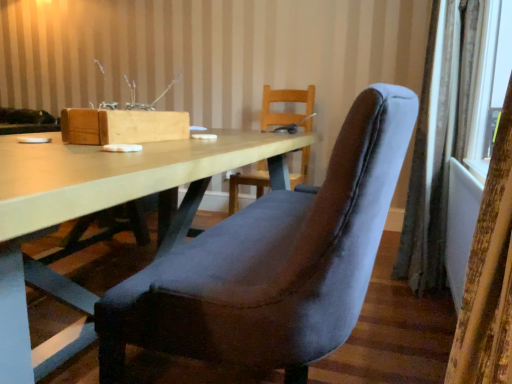
Question: Is velvet curtain at right, arranged as the 2th curtain when viewed from the right, shorter than velvet blue chair at center?

Choices:
 (A) yes
 (B) no

Answer: (A)

Question: Can you confirm if velvet curtain at right, which is the second curtain in back-to-front order, is bigger than velvet blue chair at center?

Choices:
 (A) no
 (B) yes

Answer: (A)

Question: Does velvet curtain at right, acting as the first curtain starting from the left, appear on the right side of velvet blue chair at center?

Choices:
 (A) no
 (B) yes

Answer: (B)

Question: Considering the relative positions of velvet curtain at right, which is the second curtain in back-to-front order, and velvet blue chair at center in the image provided, is velvet curtain at right, which is the second curtain in back-to-front order, behind velvet blue chair at center?

Choices:
 (A) yes
 (B) no

Answer: (B)

Question: From the image's perspective, is velvet curtain at right, arranged as the 2th curtain when viewed from the right, located beneath velvet blue chair at center?

Choices:
 (A) yes
 (B) no

Answer: (B)

Question: Is velvet curtain at right, acting as the first curtain starting from the front, beside velvet blue chair at center?

Choices:
 (A) yes
 (B) no

Answer: (B)

Question: From the image's perspective, does velvet curtain at right, the second curtain positioned from the left, appear lower than velvet blue chair at center?

Choices:
 (A) no
 (B) yes

Answer: (A)

Question: Considering the relative sizes of velvet curtain at right, the 2th curtain from the front, and velvet blue chair at center in the image provided, is velvet curtain at right, the 2th curtain from the front, shorter than velvet blue chair at center?

Choices:
 (A) no
 (B) yes

Answer: (A)

Question: Is the surface of velvet curtain at right, the first curtain in the back-to-front sequence, in direct contact with velvet blue chair at center?

Choices:
 (A) no
 (B) yes

Answer: (A)

Question: Can you confirm if velvet curtain at right, the 2th curtain from the front, is smaller than velvet blue chair at center?

Choices:
 (A) yes
 (B) no

Answer: (A)

Question: Can you confirm if velvet curtain at right, the 2th curtain from the front, is thinner than velvet blue chair at center?

Choices:
 (A) yes
 (B) no

Answer: (A)

Question: Is velvet curtain at right, the first curtain in the back-to-front sequence, turned away from velvet blue chair at center?

Choices:
 (A) no
 (B) yes

Answer: (A)

Question: Is velvet curtain at right, acting as the first curtain starting from the front, not within matte wood table at center?

Choices:
 (A) yes
 (B) no

Answer: (A)